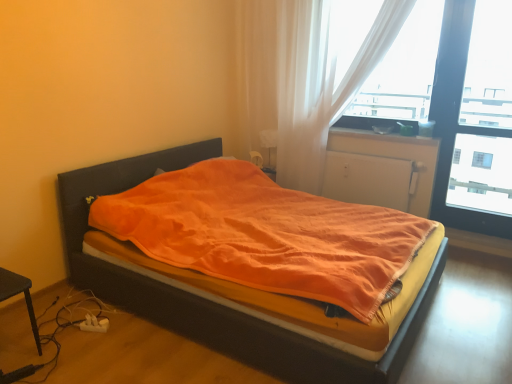
Identify the location of free space above matte plastic window sill at upper right (from a real-world perspective). The image size is (512, 384). (391, 132).